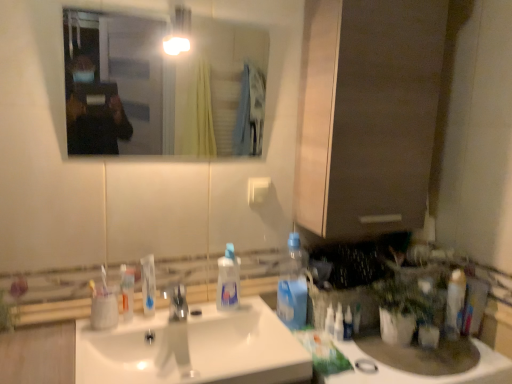
The image size is (512, 384). I want to click on vacant region in front of white plastic toothpaste tube at lower right, which appears as the first toiletry when viewed from the left, so click(x=358, y=365).